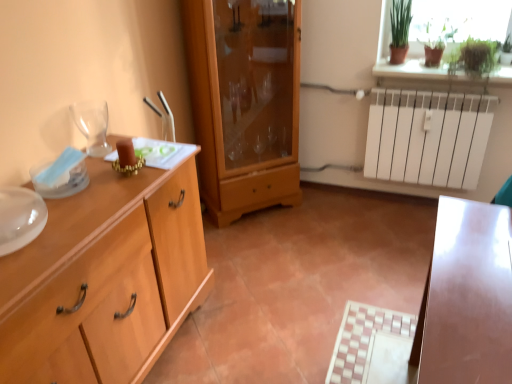
The width and height of the screenshot is (512, 384). In order to click on free location in front of wooden cabinet at center in this screenshot , I will do `click(268, 243)`.